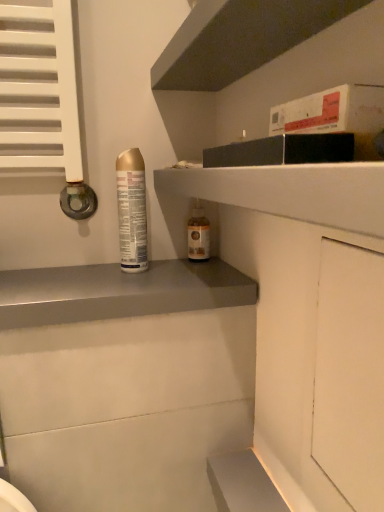
Question: Considering the positions of smooth gray shelf at center, placed as the first shelf when sorted from bottom to top, and translucent glass bottle at center, which is the second bottle from left to right, in the image, is smooth gray shelf at center, placed as the first shelf when sorted from bottom to top, wider or thinner than translucent glass bottle at center, which is the second bottle from left to right,?

Choices:
 (A) wide
 (B) thin

Answer: (A)

Question: Is smooth gray shelf at center, which ranks as the 3th shelf in top-to-bottom order, in front of or behind translucent glass bottle at center, which is the first bottle from right to left, in the image?

Choices:
 (A) front
 (B) behind

Answer: (A)

Question: Estimate the real-world distances between objects in this image. Which object is farther from the matte black shelf at upper right, which ranks as the second shelf in bottom-to-top order?

Choices:
 (A) translucent glass bottle at center, which is the first bottle from right to left
 (B) smooth gray shelf at center, placed as the first shelf when sorted from bottom to top
 (C) white matte cabinet at right
 (D) gold metallic can at left, the 1th bottle viewed from the left
 (E) dark gray matte shelf at upper center, the 1th shelf positioned from the top

Answer: (A)

Question: Which of these objects is positioned farthest from the dark gray matte shelf at upper center, the 1th shelf positioned from the top?

Choices:
 (A) translucent glass bottle at center, which is the second bottle from left to right
 (B) matte black shelf at upper right, which ranks as the second shelf in bottom-to-top order
 (C) smooth gray shelf at center, which ranks as the 3th shelf in top-to-bottom order
 (D) white matte cabinet at right
 (E) gold metallic can at left, positioned as the 2th bottle in right-to-left order

Answer: (C)